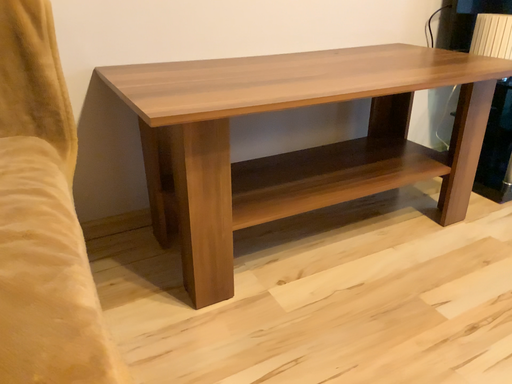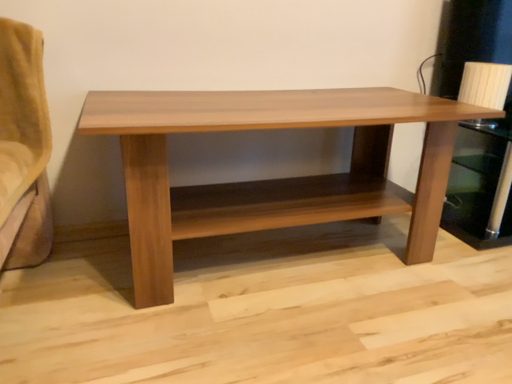
Question: Which way did the camera rotate in the video?

Choices:
 (A) rotated left
 (B) rotated right

Answer: (A)